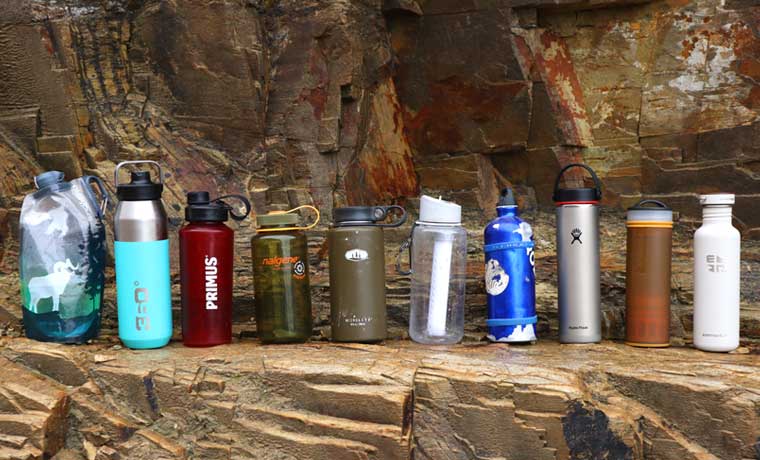
The height and width of the screenshot is (460, 760). Identify the location of bottle. (x=58, y=248), (x=119, y=249), (x=198, y=250), (x=273, y=258), (x=356, y=259), (x=438, y=263), (x=517, y=260), (x=581, y=265), (x=650, y=267), (x=727, y=273).